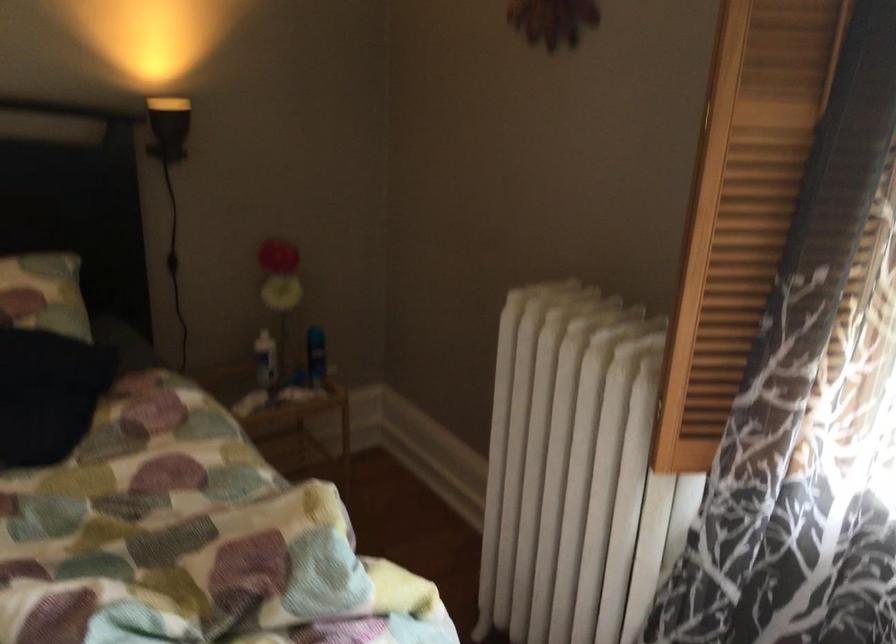
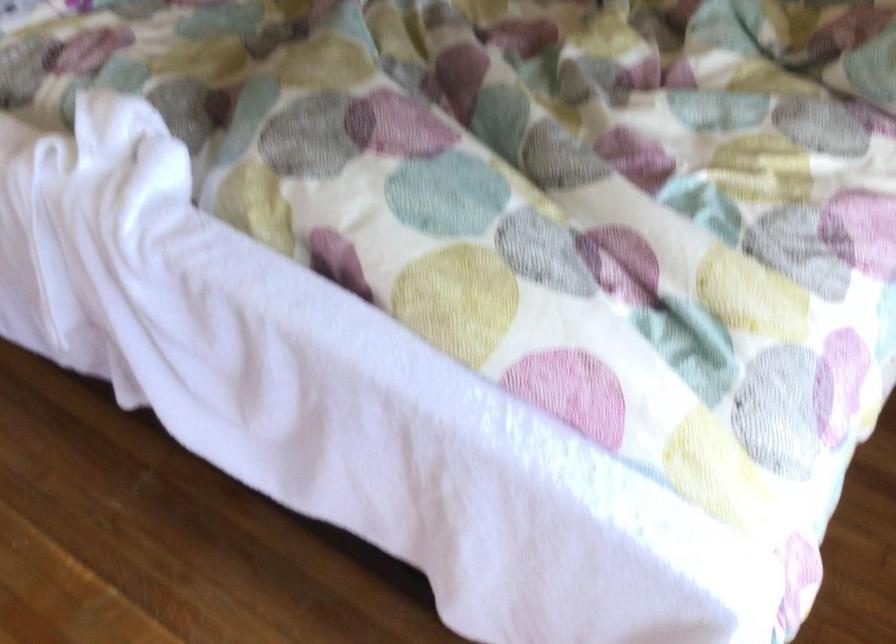
The images are taken continuously from a first-person perspective. In which direction is your viewpoint rotating?

The rotation direction of the camera is left-down.